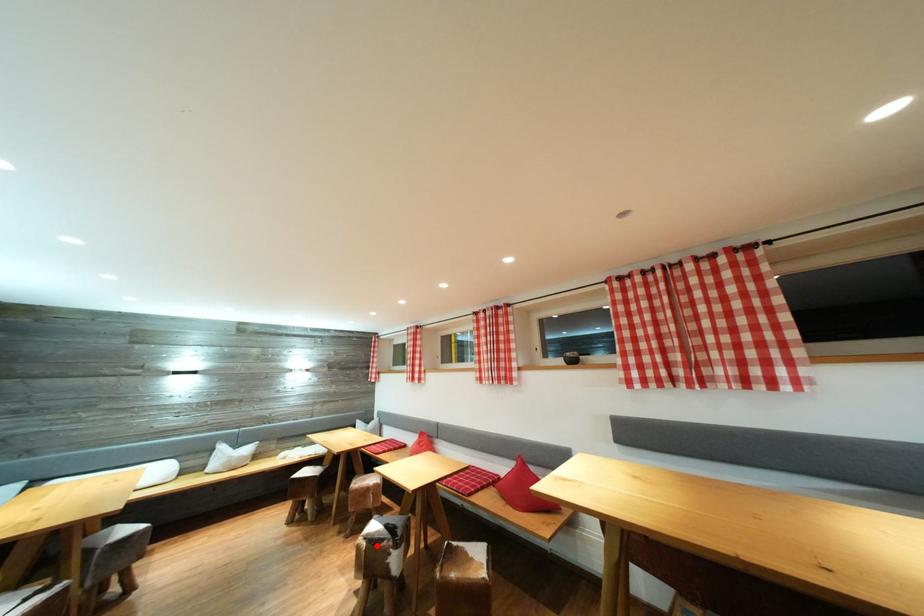
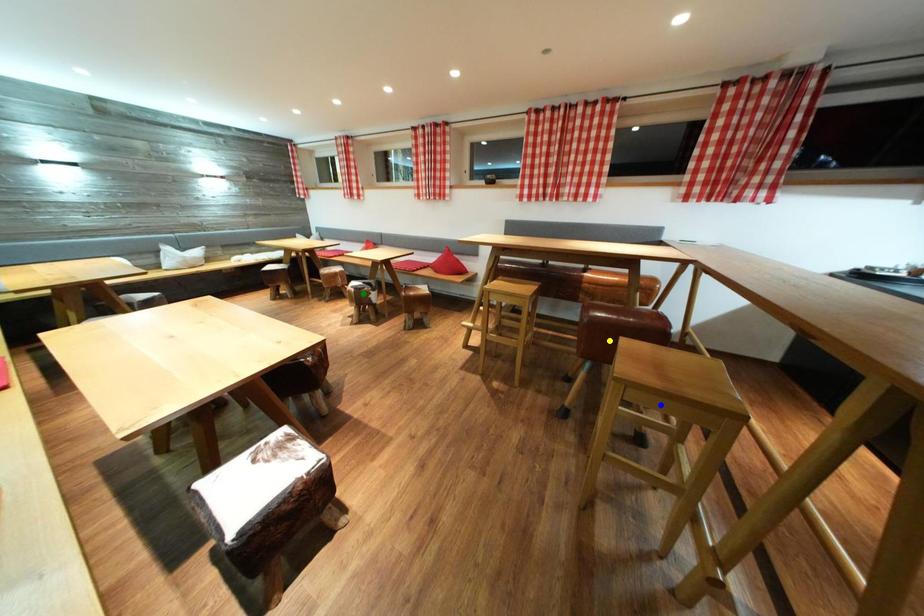
Question: I am providing you with two images of the same scene from different viewpoints. A red point is marked on the first image. You are given multiple points on the second image. Can you choose the point in image 2 that corresponds to the point in image 1?

Choices:
 (A) green point
 (B) yellow point
 (C) blue point

Answer: (A)